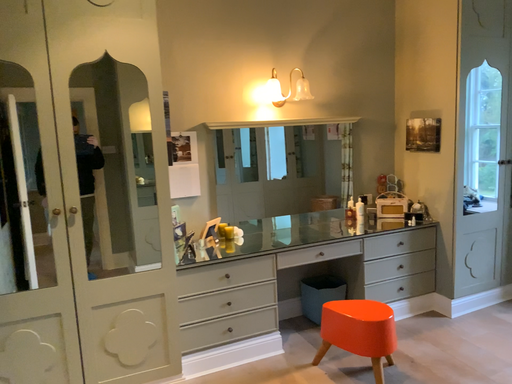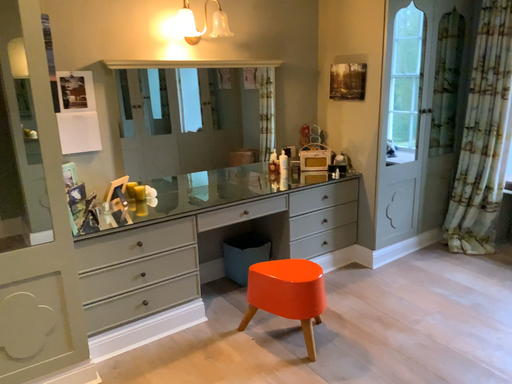
Question: How did the camera likely rotate when shooting the video?

Choices:
 (A) rotated right
 (B) rotated left

Answer: (A)